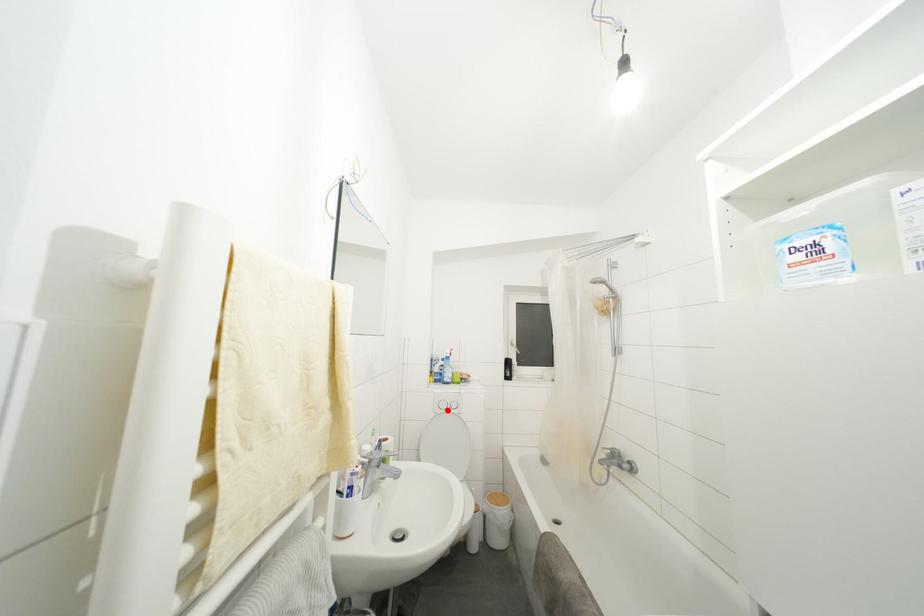
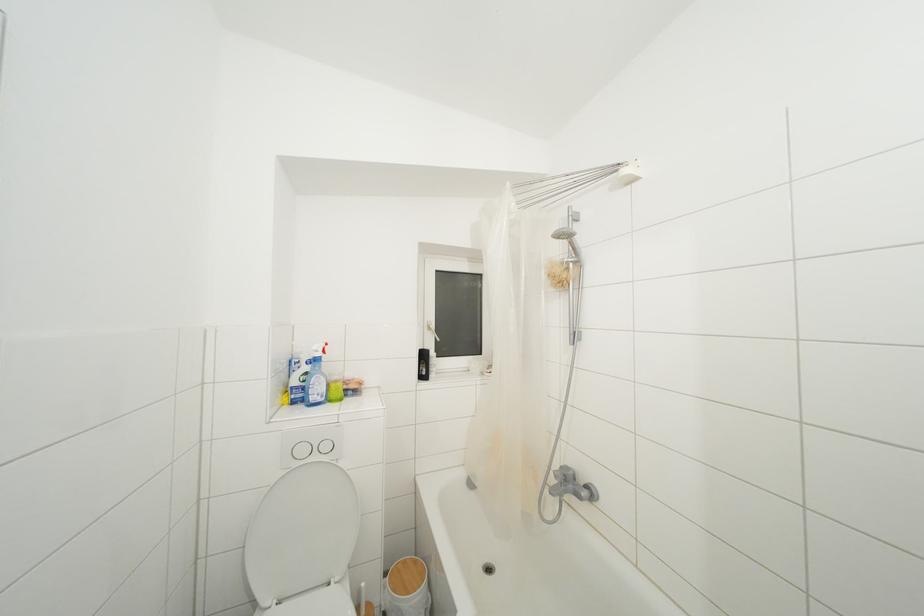
Question: I am providing you with two images of the same scene from different viewpoints. Given a red point in image1, look at the same physical point in image2. Is it:

Choices:
 (A) Closer to the viewpoint
 (B) Farther from the viewpoint

Answer: (A)